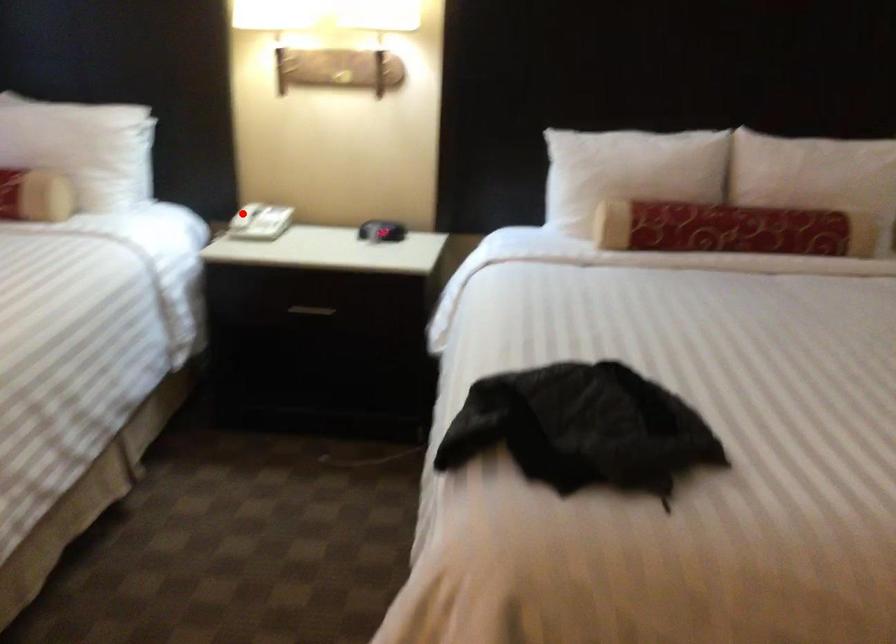
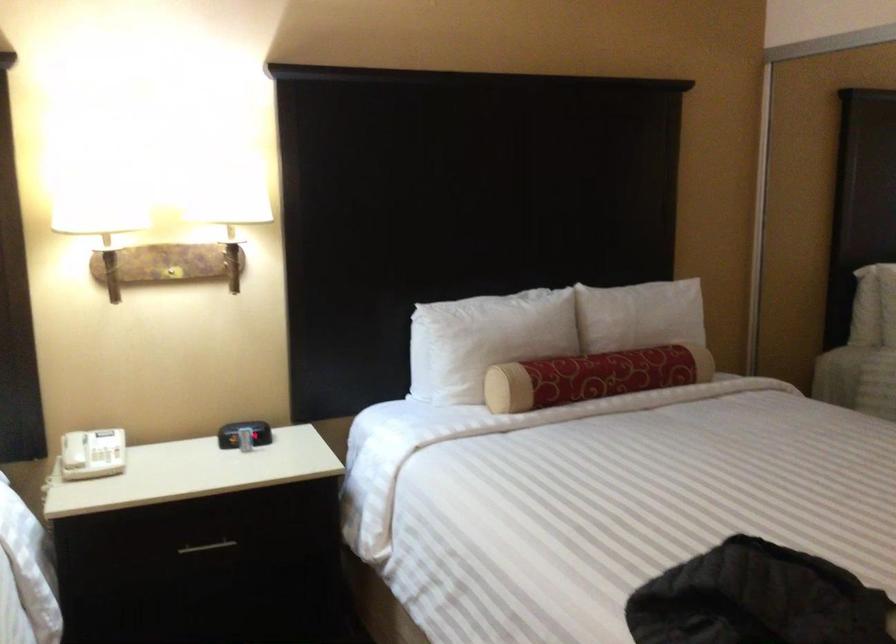
Find the pixel in the second image that matches the highlighted location in the first image.

(73, 450)